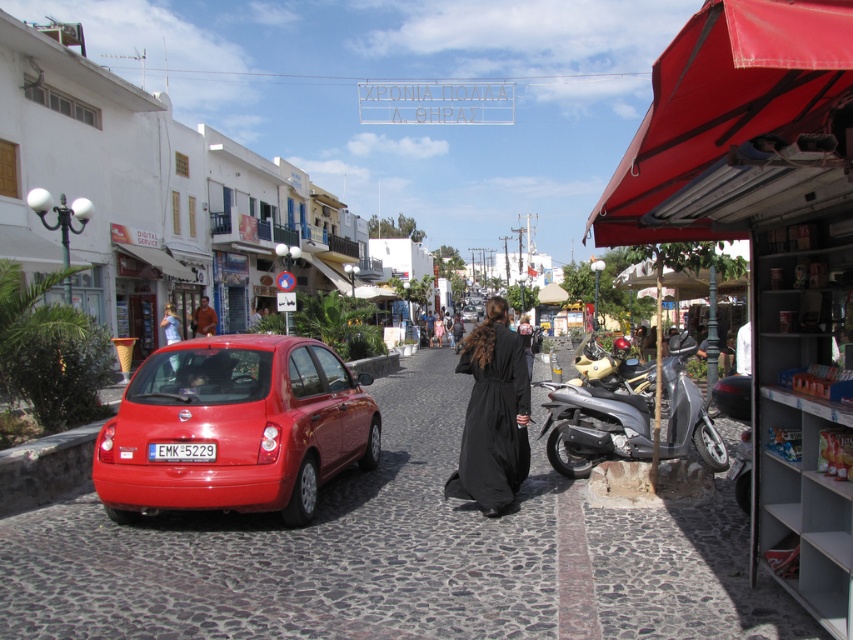
Question: Among these objects, which one is nearest to the camera?

Choices:
 (A) glossy red car at left
 (B) metallic silver scooter at right

Answer: (A)

Question: Is red fabric canopy at right below metallic silver scooter at right?

Choices:
 (A) yes
 (B) no

Answer: (B)

Question: Considering the real-world distances, which object is farthest from the glossy red car at left?

Choices:
 (A) black matte dress at center
 (B) brown leather jacket at center
 (C) metallic silver scooter at right

Answer: (B)

Question: Is red fabric canopy at right above shiny chrome motorcycle at center-right?

Choices:
 (A) yes
 (B) no

Answer: (A)

Question: Does silver metallic scooter at right appear under black matte dress at center?

Choices:
 (A) yes
 (B) no

Answer: (A)

Question: Estimate the real-world distances between objects in this image. Which object is farther from the silver metallic scooter at right?

Choices:
 (A) red fabric canopy at right
 (B) glossy red car at left
 (C) brown leather jacket at center
 (D) black matte dress at center

Answer: (C)